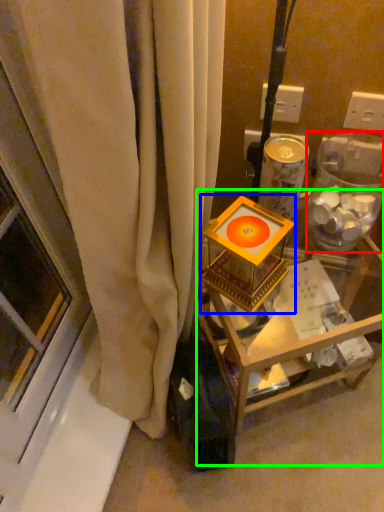
Question: Which object is the closest to the glass box (highlighted by a red box)? Choose among these: candle holder (highlighted by a blue box) or furniture (highlighted by a green box).

Choices:
 (A) candle holder
 (B) furniture

Answer: (A)